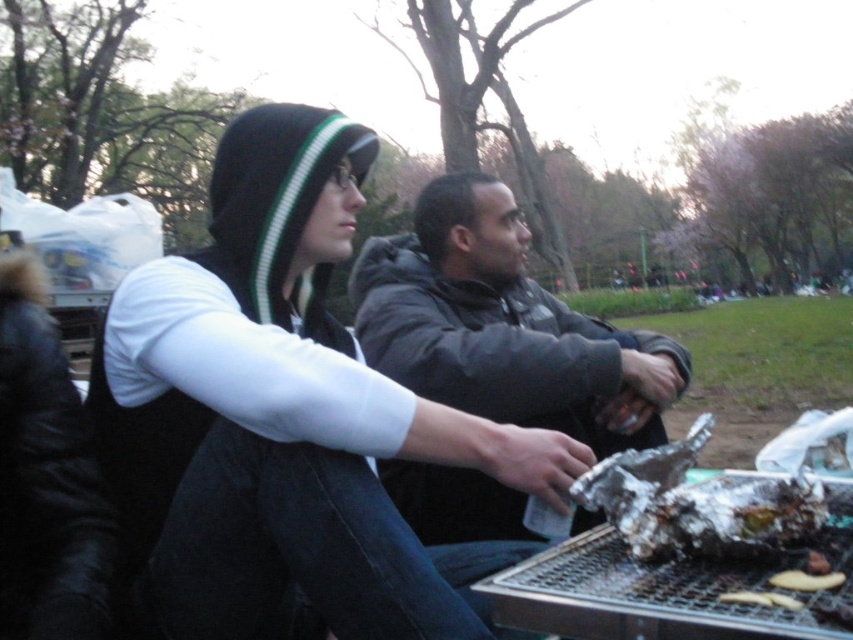
Question: Does black fleece hoodie at upper left appear over dark gray jacket at center?

Choices:
 (A) yes
 (B) no

Answer: (B)

Question: Considering the real-world distances, which object is farthest from the golden brown crispy bread at lower right?

Choices:
 (A) black fleece hoodie at upper left
 (B) dark gray jacket at center

Answer: (B)

Question: Which of the following is the farthest from the observer?

Choices:
 (A) (485, 413)
 (B) (228, 248)

Answer: (A)

Question: Does brown crispy bread at lower right appear on the left side of golden brown crispy bread at lower right?

Choices:
 (A) no
 (B) yes

Answer: (A)

Question: Is black fleece hoodie at upper left to the left of brown crispy bread at lower right from the viewer's perspective?

Choices:
 (A) no
 (B) yes

Answer: (B)

Question: Which of these objects is positioned closest to the dark gray jacket at center?

Choices:
 (A) golden brown crispy bread at lower right
 (B) black fleece hoodie at upper left
 (C) brown crispy bread at lower right

Answer: (B)